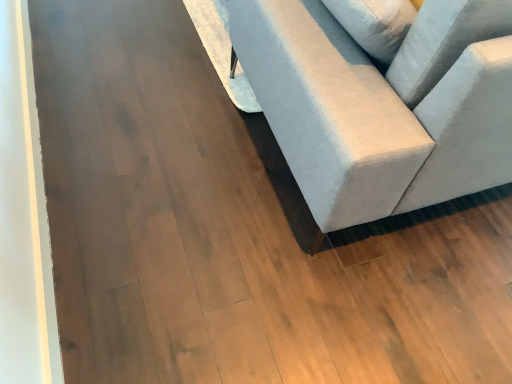
Identify the location of free space in front of light gray fabric couch at center. This screenshot has height=384, width=512. (284, 273).